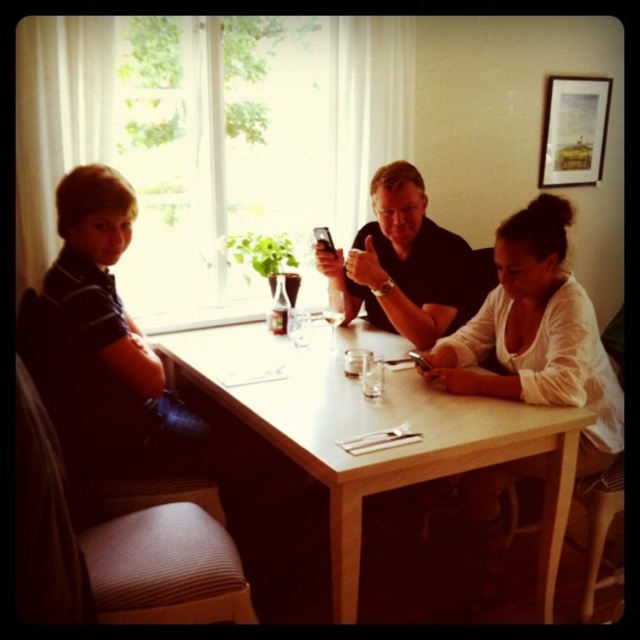
Question: From the image, what is the correct spatial relationship of light wood table at center in relation to brown textured chair at left?

Choices:
 (A) left
 (B) right

Answer: (B)

Question: Which point is closer to the camera taking this photo?

Choices:
 (A) (604, 429)
 (B) (356, 416)

Answer: (B)

Question: Considering the relative positions of light wood table at center and matte black shirt at center in the image provided, where is light wood table at center located with respect to matte black shirt at center?

Choices:
 (A) above
 (B) below

Answer: (B)

Question: Can you confirm if light wood table at center is positioned above white matte shirt at center?

Choices:
 (A) no
 (B) yes

Answer: (A)

Question: Which of these objects is positioned closest to the matte black shirt at center?

Choices:
 (A) light wood table at center
 (B) white matte shirt at center

Answer: (A)

Question: Estimate the real-world distances between objects in this image. Which object is farther from the white matte shirt at center?

Choices:
 (A) matte black shirt at center
 (B) brown textured chair at left

Answer: (B)